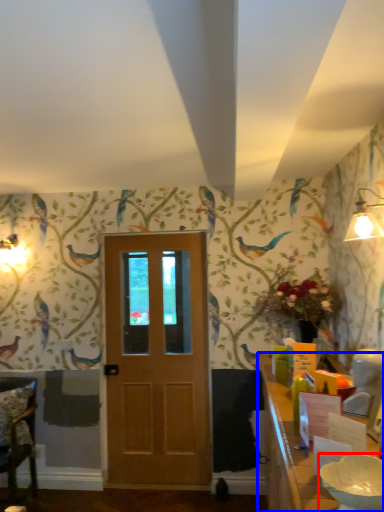
Question: Which point is closer to the camera, bowl (highlighted by a red box) or table (highlighted by a blue box)?

Choices:
 (A) bowl
 (B) table

Answer: (B)